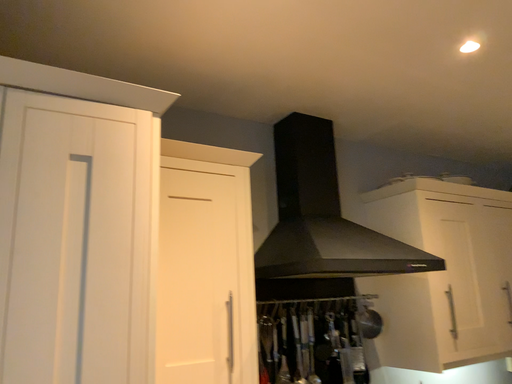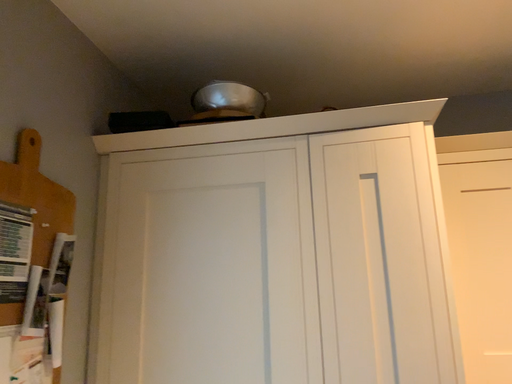
Question: Which way did the camera rotate in the video?

Choices:
 (A) rotated left
 (B) rotated right

Answer: (A)